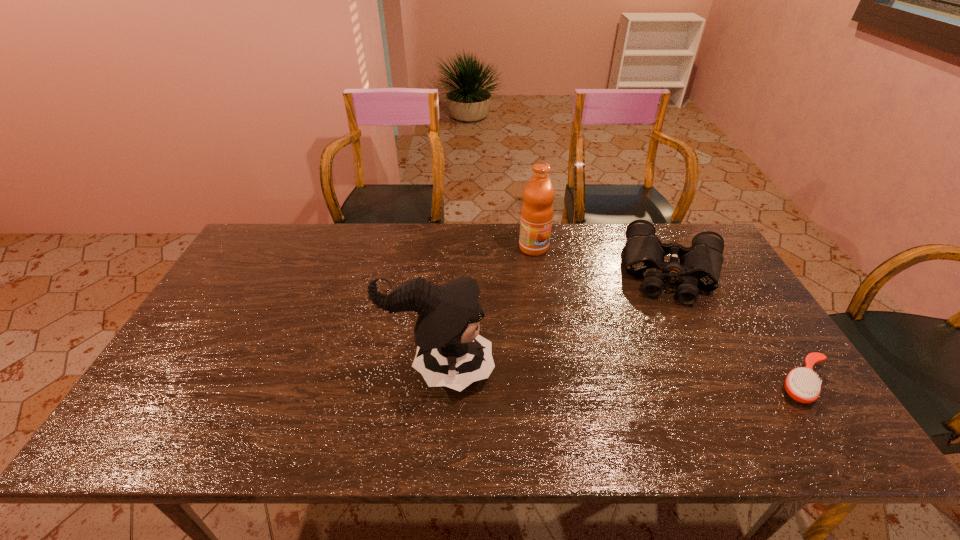
This screenshot has width=960, height=540. In order to click on vacant space in between the second object from left to right and the doll in this screenshot , I will do `click(487, 308)`.

I want to click on free point between the fruit juice and the third tallest object, so click(604, 259).

The image size is (960, 540). Identify the location of vacant space that is in between the third object from right to left and the binoculars. (604, 259).

Find the location of a particular element. The height and width of the screenshot is (540, 960). blank region between the shortest object and the fruit juice is located at coordinates (669, 315).

I want to click on object that is the closest to the fruit juice, so click(699, 266).

Identify which object is the third closest to the hairbrush. Please provide its 2D coordinates. Your answer should be formatted as a tuple, i.e. [(x, y)], where the tuple contains the x and y coordinates of a point satisfying the conditions above.

[(450, 352)]

The height and width of the screenshot is (540, 960). What are the coordinates of `vacant space that satisfies the following two spatial constraints: 1. on the front side of the fruit juice; 2. on the left side of the hairbrush` in the screenshot? It's located at (554, 383).